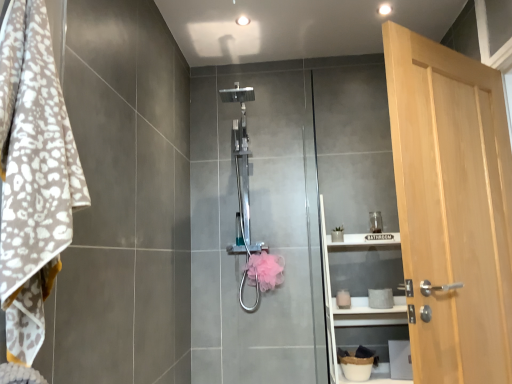
Question: From the image's perspective, is white leopard print towel at left positioned above or below light brown wood door at right?

Choices:
 (A) below
 (B) above

Answer: (B)

Question: Is white leopard print towel at left inside or outside of light brown wood door at right?

Choices:
 (A) inside
 (B) outside

Answer: (B)

Question: Estimate the real-world distances between objects in this image. Which object is closer to the polished chrome shower at center?

Choices:
 (A) white matte shelf at center
 (B) light brown wood door at right
 (C) pink fluffy hand towel at center
 (D) white leopard print towel at left

Answer: (C)

Question: Which object is positioned closest to the polished chrome shower at center?

Choices:
 (A) light brown wood door at right
 (B) white leopard print towel at left
 (C) pink fluffy hand towel at center
 (D) white matte shelf at center

Answer: (C)